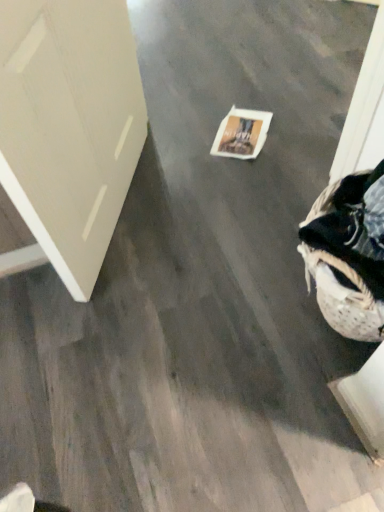
You are a GUI agent. You are given a task and a screenshot of the screen. Output one action in this format:
    pyautogui.click(x=<x>, y=<y>)
    Task: Click on the vacant space in front of white matte door at left
    Image resolution: width=384 pixels, height=512 pixels.
    Given the screenshot: What is the action you would take?
    pyautogui.click(x=131, y=321)